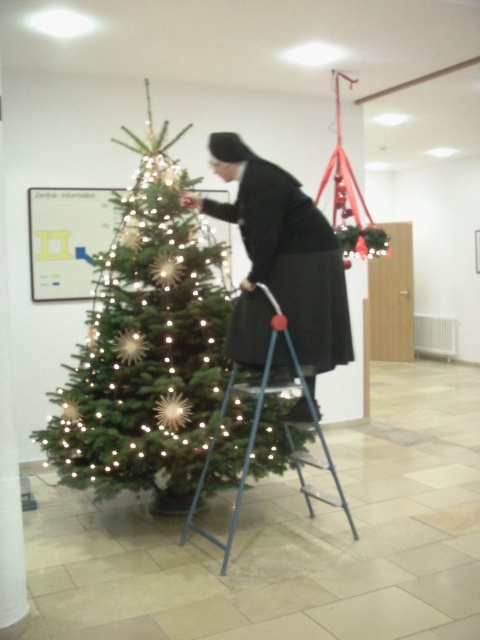
Is black matte dress at center smaller than blue metallic ladder at center?

Correct, black matte dress at center occupies less space than blue metallic ladder at center.

Does black matte dress at center have a greater height compared to blue metallic ladder at center?

In fact, black matte dress at center may be shorter than blue metallic ladder at center.

Locate an element on the screen. This screenshot has width=480, height=640. black matte dress at center is located at coordinates (292, 260).

Between green matte christmas tree at center and blue metallic ladder at center, which one has less height?

Standing shorter between the two is blue metallic ladder at center.

Can you confirm if green matte christmas tree at center is taller than blue metallic ladder at center?

Yes, green matte christmas tree at center is taller than blue metallic ladder at center.

Is point (202, 268) behind point (292, 380)?

Yes, it is behind point (292, 380).

In order to click on green matte christmas tree at center in this screenshot , I will do `click(146, 344)`.

Does green matte christmas tree at center have a smaller size compared to black matte dress at center?

Actually, green matte christmas tree at center might be larger than black matte dress at center.

Does green matte christmas tree at center have a larger size compared to black matte dress at center?

Correct, green matte christmas tree at center is larger in size than black matte dress at center.

Which is in front, point (226, 435) or point (249, 276)?

Point (249, 276) is in front.

The height and width of the screenshot is (640, 480). I want to click on green matte christmas tree at center, so 146,344.